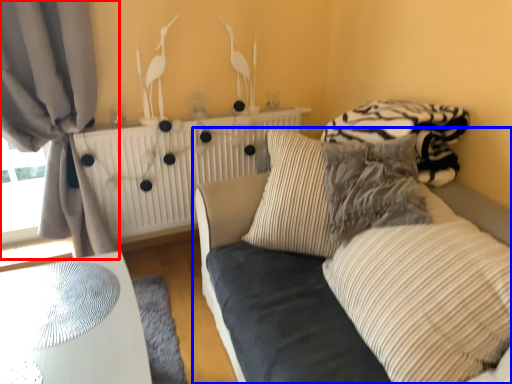
Question: Which object appears farthest to the camera in this image, curtain (highlighted by a red box) or studio couch (highlighted by a blue box)?

Choices:
 (A) curtain
 (B) studio couch

Answer: (A)